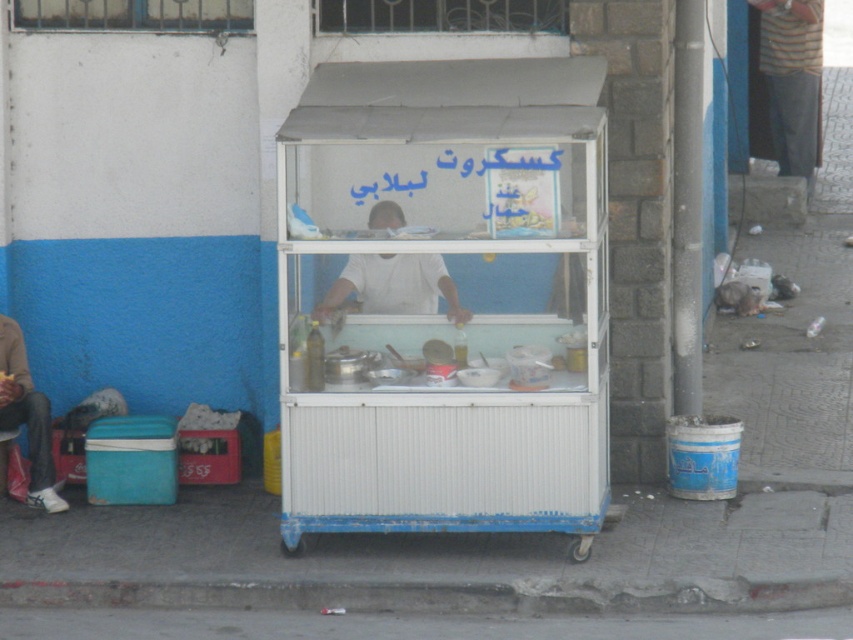
Question: Among these points, which one is farthest from the camera?

Choices:
 (A) [x=36, y=394]
 (B) [x=339, y=289]

Answer: (A)

Question: Which object appears closest to the camera in this image?

Choices:
 (A) concrete at lower center
 (B) white metal cart at center
 (C) matte black jacket at left

Answer: (A)

Question: Which object is farther from the camera taking this photo?

Choices:
 (A) white matte street vendor at center
 (B) concrete at lower center
 (C) matte black jacket at left

Answer: (C)

Question: Can you confirm if white metal cart at center is positioned to the left of concrete at lower center?

Choices:
 (A) no
 (B) yes

Answer: (A)

Question: Where is concrete at lower center located in relation to white matte street vendor at center in the image?

Choices:
 (A) left
 (B) right

Answer: (B)

Question: Is white metal cart at center wider than white matte street vendor at center?

Choices:
 (A) yes
 (B) no

Answer: (A)